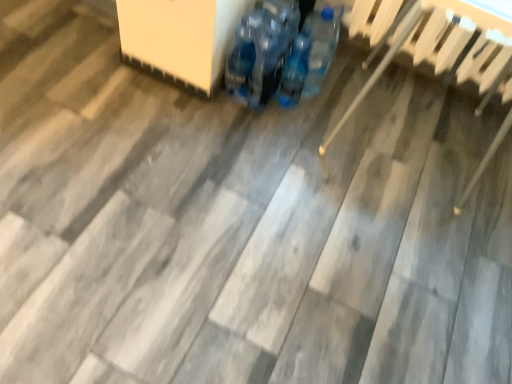
Find the location of a particular element. The image size is (512, 384). blue plastic bottles at center is located at coordinates (295, 70).

The height and width of the screenshot is (384, 512). Describe the element at coordinates (270, 54) in the screenshot. I see `blue plastic bottles at center` at that location.

I want to click on blue plastic bottles at center, so click(x=295, y=70).

Considering the sizes of objects blue plastic bottles at center and wooden chair at right in the image provided, who is taller, blue plastic bottles at center or wooden chair at right?

wooden chair at right is taller.

Which object is wider, blue plastic bottles at center or wooden chair at right?

With larger width is wooden chair at right.

In order to click on bottle below the wooden chair at right (from a real-world perspective) in this screenshot , I will do `click(295, 70)`.

Which point is more forward, (303, 80) or (370, 80)?

Positioned in front is point (303, 80).

Considering the sizes of objects wooden chair at right and blue plastic bottles at center in the image provided, who is wider, wooden chair at right or blue plastic bottles at center?

wooden chair at right is wider.

Is wooden chair at right shorter than blue plastic bottles at center?

In fact, wooden chair at right may be taller than blue plastic bottles at center.

Is wooden chair at right touching blue plastic bottles at center?

They are not placed beside each other.

Looking at this image, from a real-world perspective, is wooden chair at right positioned over blue plastic bottles at center based on gravity?

Yes, from a real-world perspective, wooden chair at right is above blue plastic bottles at center.

Does point (280, 86) come in front of point (475, 52)?

No, it is not.

From the image's perspective, is blue plastic bottles at center on wooden chair at right?

Indeed, from the image's perspective, blue plastic bottles at center is shown above wooden chair at right.

Could you tell me if blue plastic bottles at center is facing wooden chair at right?

No, blue plastic bottles at center is not oriented towards wooden chair at right.

Considering the sizes of objects blue plastic bottles at center and wooden chair at right in the image provided, who is smaller, blue plastic bottles at center or wooden chair at right?

blue plastic bottles at center.

There is a blue plastic bottles at center. Where is `footwear above it (from a real-world perspective)`? Image resolution: width=512 pixels, height=384 pixels. footwear above it (from a real-world perspective) is located at coordinates (270, 54).

Can you confirm if blue plastic bottles at center is shorter than blue plastic bottles at center?

In fact, blue plastic bottles at center may be taller than blue plastic bottles at center.

Considering the sizes of objects blue plastic bottles at center and blue plastic bottles at center in the image provided, who is thinner, blue plastic bottles at center or blue plastic bottles at center?

With smaller width is blue plastic bottles at center.

Considering the relative positions of blue plastic bottles at center and blue plastic bottles at center in the image provided, is blue plastic bottles at center to the left of blue plastic bottles at center from the viewer's perspective?

Correct, you'll find blue plastic bottles at center to the left of blue plastic bottles at center.

Which is in front, blue plastic bottles at center or blue plastic bottles at center?

Positioned in front is blue plastic bottles at center.

Which object is positioned more to the right, blue plastic bottles at center or blue plastic bottles at center?

Positioned to the right is blue plastic bottles at center.

From the image's perspective, is blue plastic bottles at center on top of blue plastic bottles at center?

No, from the image's perspective, blue plastic bottles at center is not on top of blue plastic bottles at center.

Is wooden chair at right looking in the opposite direction of blue plastic bottles at center?

No, wooden chair at right's orientation is not away from blue plastic bottles at center.

Are wooden chair at right and blue plastic bottles at center far apart?

wooden chair at right is actually quite close to blue plastic bottles at center.

Locate an element on the screen. Image resolution: width=512 pixels, height=384 pixels. bottle located on the left of wooden chair at right is located at coordinates (295, 70).

This screenshot has height=384, width=512. In the image, there is a wooden chair at right. Identify the location of bottle below it (from a real-world perspective). (295, 70).

Estimate the real-world distances between objects in this image. Which object is further from blue plastic bottles at center, blue plastic bottles at center or wooden chair at right?

wooden chair at right lies further to blue plastic bottles at center than the other object.

Based on their spatial positions, is blue plastic bottles at center or wooden chair at right further from blue plastic bottles at center?

wooden chair at right is positioned further to the anchor blue plastic bottles at center.

Estimate the real-world distances between objects in this image. Which object is closer to wooden chair at right, blue plastic bottles at center or blue plastic bottles at center?

Among the two, blue plastic bottles at center is located nearer to wooden chair at right.

Looking at the image, which one is located closer to blue plastic bottles at center, wooden chair at right or blue plastic bottles at center?

blue plastic bottles at center.

When comparing their distances from blue plastic bottles at center, does wooden chair at right or blue plastic bottles at center seem further?

Based on the image, wooden chair at right appears to be further to blue plastic bottles at center.

Estimate the real-world distances between objects in this image. Which object is further from wooden chair at right, blue plastic bottles at center or blue plastic bottles at center?

blue plastic bottles at center.

Where is `bottle situated between blue plastic bottles at center and wooden chair at right from left to right`? This screenshot has width=512, height=384. bottle situated between blue plastic bottles at center and wooden chair at right from left to right is located at coordinates (295, 70).